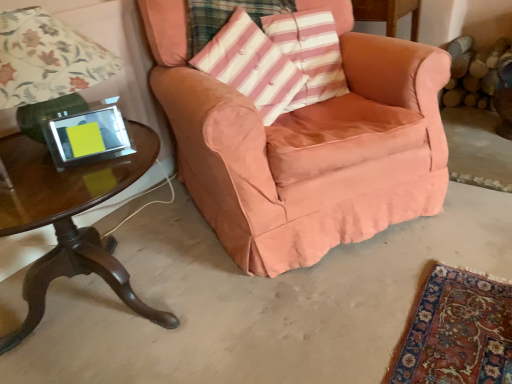
Question: Is the position of shiny dark wood table at lower left more distant than that of suede-like peach armchair at center?

Choices:
 (A) no
 (B) yes

Answer: (A)

Question: Is suede-like peach armchair at center surrounded by shiny dark wood table at lower left?

Choices:
 (A) no
 (B) yes

Answer: (A)

Question: Considering the relative sizes of shiny dark wood table at lower left and suede-like peach armchair at center in the image provided, is shiny dark wood table at lower left taller than suede-like peach armchair at center?

Choices:
 (A) yes
 (B) no

Answer: (B)

Question: Is shiny dark wood table at lower left to the left of suede-like peach armchair at center from the viewer's perspective?

Choices:
 (A) yes
 (B) no

Answer: (A)

Question: Is the depth of shiny dark wood table at lower left less than that of suede-like peach armchair at center?

Choices:
 (A) no
 (B) yes

Answer: (B)

Question: Based on their sizes in the image, would you say matte green lamp at left is bigger or smaller than pink striped cushion at upper center?

Choices:
 (A) small
 (B) big

Answer: (B)

Question: In terms of width, does matte green lamp at left look wider or thinner when compared to pink striped cushion at upper center?

Choices:
 (A) wide
 (B) thin

Answer: (A)

Question: From the image's perspective, is matte green lamp at left above or below pink striped cushion at upper center?

Choices:
 (A) below
 (B) above

Answer: (A)

Question: From a real-world perspective, relative to pink striped cushion at upper center, is matte green lamp at left vertically above or below?

Choices:
 (A) above
 (B) below

Answer: (A)

Question: Is shiny dark wood table at lower left in front of or behind matte green lamp at left in the image?

Choices:
 (A) front
 (B) behind

Answer: (A)

Question: From the image's perspective, is shiny dark wood table at lower left located above or below matte green lamp at left?

Choices:
 (A) below
 (B) above

Answer: (A)

Question: Does point (147, 311) appear closer or farther from the camera than point (95, 66)?

Choices:
 (A) closer
 (B) farther

Answer: (B)

Question: Is shiny dark wood table at lower left inside the boundaries of matte green lamp at left, or outside?

Choices:
 (A) inside
 (B) outside

Answer: (B)

Question: Is suede-like peach armchair at center in front of or behind pink striped cushion at upper center in the image?

Choices:
 (A) front
 (B) behind

Answer: (A)

Question: Would you say suede-like peach armchair at center is inside or outside pink striped cushion at upper center?

Choices:
 (A) outside
 (B) inside

Answer: (A)